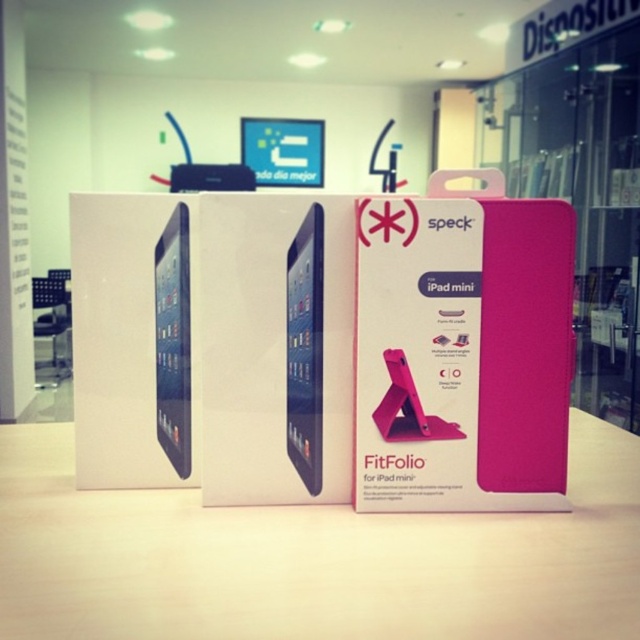
Can you confirm if pink matte table at center is shorter than matte black tablet at left?

Yes.

Describe the element at coordinates (312, 557) in the screenshot. I see `pink matte table at center` at that location.

Is point (221, 609) positioned in front of point (160, 321)?

Yes, point (221, 609) is in front of point (160, 321).

Where is `pink matte table at center`? pink matte table at center is located at coordinates coord(312,557).

Is pink matte table at center in front of matte black tablet at center?

Yes.

Can you confirm if pink matte table at center is shorter than matte black tablet at center?

Correct, pink matte table at center is not as tall as matte black tablet at center.

The width and height of the screenshot is (640, 640). What are the coordinates of `pink matte table at center` in the screenshot? It's located at (312, 557).

Can you confirm if matte black tablet at center is positioned to the right of matte black tablet at left?

Correct, you'll find matte black tablet at center to the right of matte black tablet at left.

Does matte black tablet at center appear on the left side of matte black tablet at left?

In fact, matte black tablet at center is to the right of matte black tablet at left.

Who is more distant from viewer, (307, 348) or (172, 212)?

Point (172, 212)

Locate an element on the screen. The image size is (640, 640). matte black tablet at center is located at coordinates (305, 349).